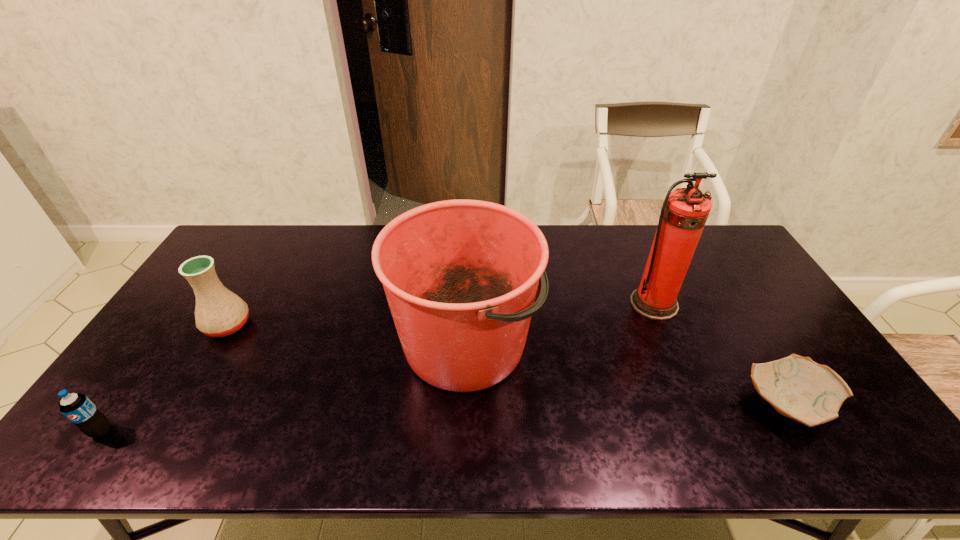
Image resolution: width=960 pixels, height=540 pixels. Find the location of `the tallest object`. the tallest object is located at coordinates (684, 213).

Find the location of a particular element. fire extinguisher is located at coordinates (684, 213).

You are a GUI agent. You are given a task and a screenshot of the screen. Output one action in this format:
    pyautogui.click(x=<x>, y=<y>)
    Task: Click on the bucket
    Image resolution: width=960 pixels, height=540 pixels.
    Given the screenshot: What is the action you would take?
    pyautogui.click(x=460, y=276)

In order to click on the second tallest object in this screenshot , I will do `click(460, 276)`.

Locate an element on the screen. the third tallest object is located at coordinates (219, 312).

At what (x,y) coordinates should I click in order to perform the action: click on the farther pottery. Please return your answer as a coordinate pair (x, y). The height and width of the screenshot is (540, 960). Looking at the image, I should click on (219, 312).

Locate an element on the screen. The image size is (960, 540). the leftmost object is located at coordinates (78, 408).

Locate an element on the screen. The height and width of the screenshot is (540, 960). the second shortest object is located at coordinates (78, 408).

This screenshot has height=540, width=960. Find the location of `the right pottery`. the right pottery is located at coordinates (797, 387).

Where is `the rightmost object`? This screenshot has width=960, height=540. the rightmost object is located at coordinates (797, 387).